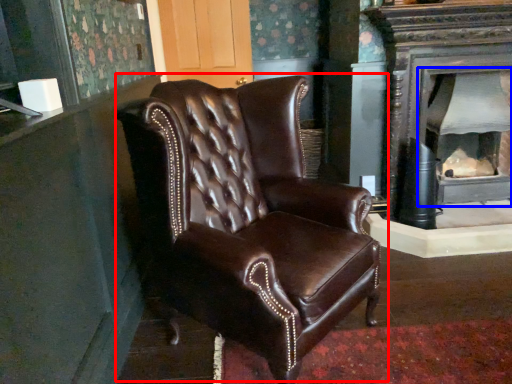
Question: Among these objects, which one is farthest to the camera, chair (highlighted by a red box) or fireplace (highlighted by a blue box)?

Choices:
 (A) chair
 (B) fireplace

Answer: (B)